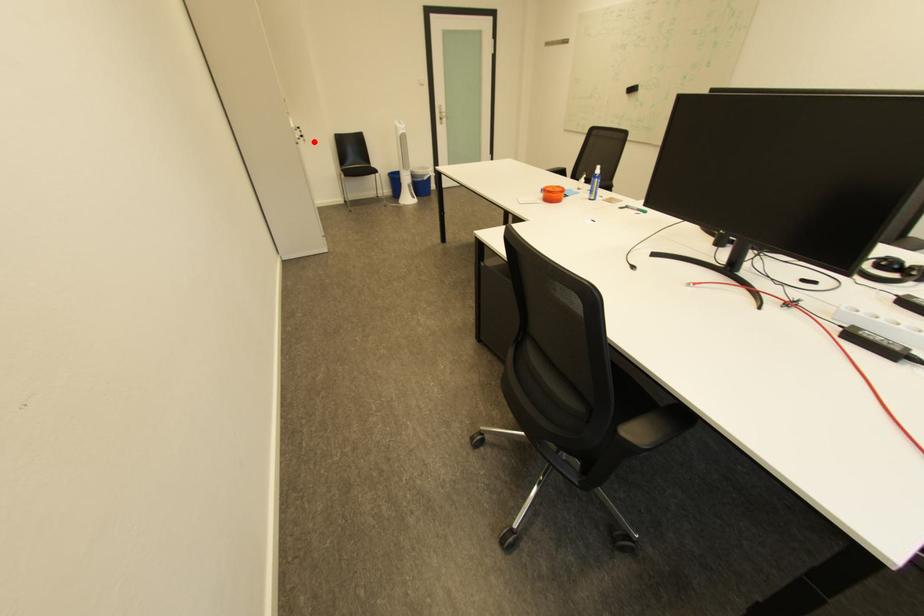
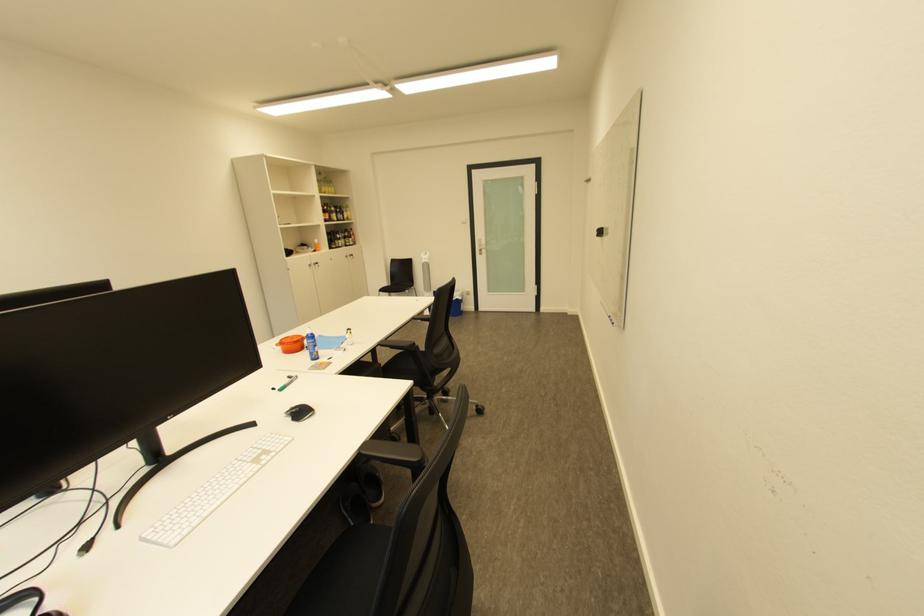
Question: I am providing you with two images of the same scene from different viewpoints. A red point is shown in image1. For the corresponding object point in image2, is it positioned nearer or farther from the camera?

Choices:
 (A) Nearer
 (B) Farther

Answer: (B)